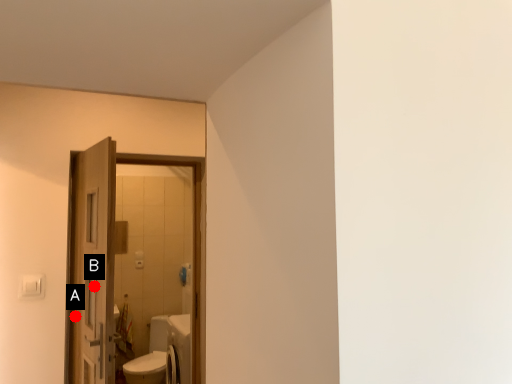
Question: Two points are circled on the image, labeled by A and B beside each circle. Which of the following is the closest to the observer?

Choices:
 (A) A is closer
 (B) B is closer

Answer: (B)